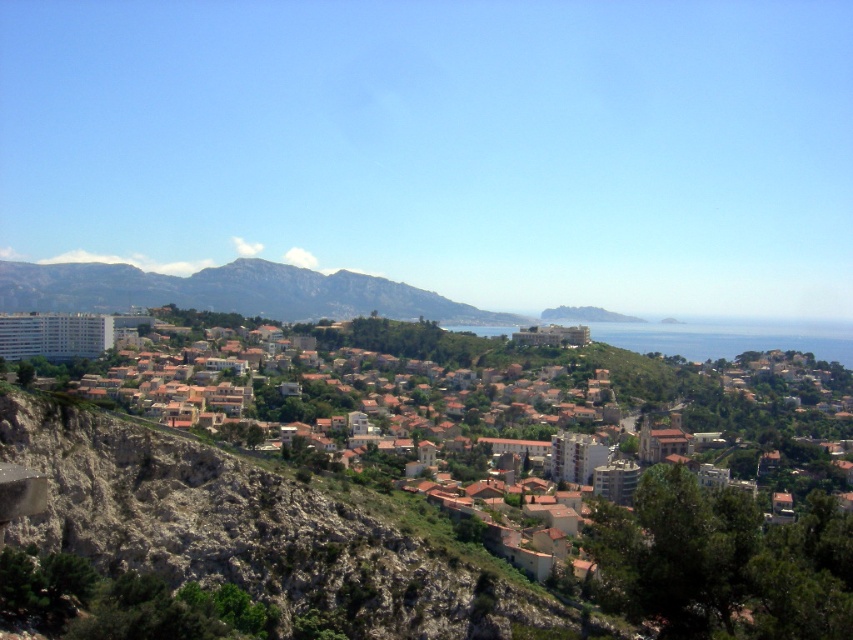
You are a drone operator flying over the coastal town. Your mission is to deliver a package to the white concrete buildings at center. According to the map, the coordinates of the town hall are at point 0.797, 0.219. Are you on the right path?

The white concrete buildings at center are located at point (186, 509), so yes, you are on the right path to deliver the package to the white concrete buildings at center.

You are standing at the cliff edge overlooking the coastal town. You notice two points marked on the image. The first point is at coordinates point [173,461] and the second is at point [683,355]. Which point is closer to you as you stand at the cliff edge?

Point [173,461] is in front of point [683,355], so the first point is closer to you.

You are a tourist standing on the rocky cliff face in the foreground of the coastal town. You want to take a photo of the blue water at center and the white concrete buildings at center. Which object should you point your camera towards first if you want to capture both in one shot?

You should point your camera towards the white concrete buildings at center first because they are located to the left of the blue water at center, so capturing them first will ensure both are included in the frame.